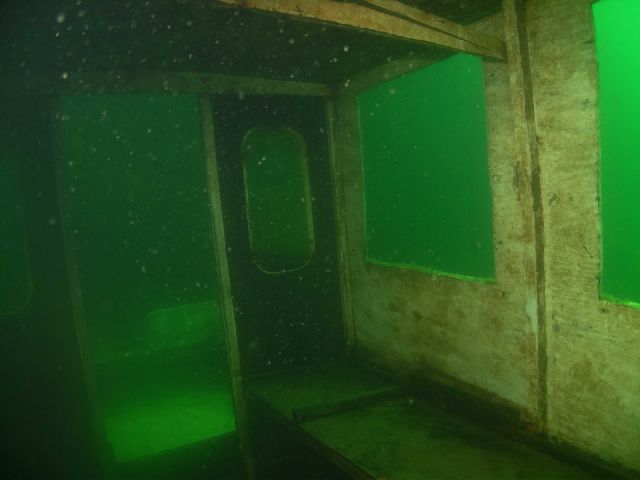
Where is `ceiling`? The height and width of the screenshot is (480, 640). ceiling is located at coordinates (299, 52).